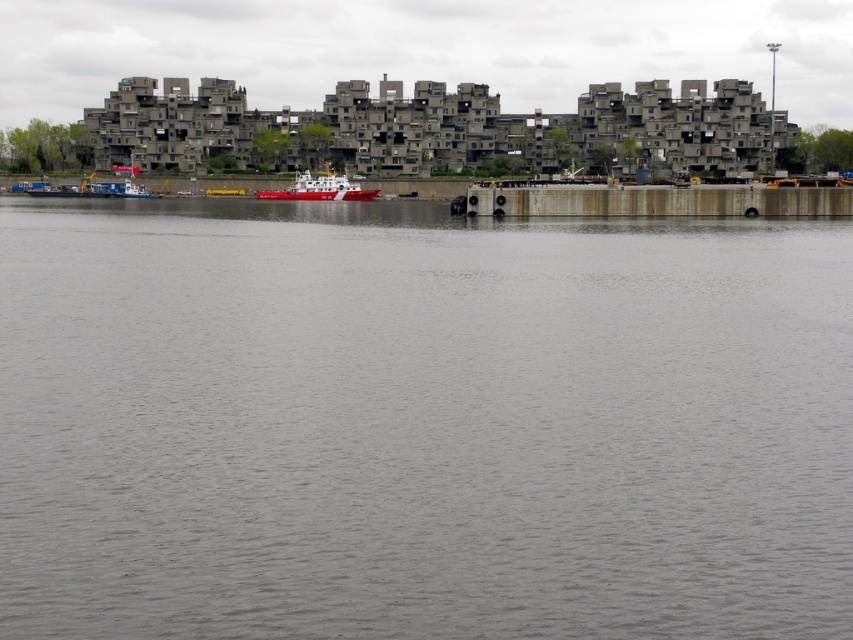
Question: Which of the following is the closest to the observer?

Choices:
 (A) red glossy boat at center
 (B) gray water at center

Answer: (B)

Question: Can you confirm if gray water at center is positioned to the left of red glossy boat at center?

Choices:
 (A) yes
 (B) no

Answer: (B)

Question: Which point is closer to the camera?

Choices:
 (A) red glossy boat at center
 (B) gray water at center

Answer: (B)

Question: Can you confirm if gray water at center is thinner than red glossy boat at center?

Choices:
 (A) no
 (B) yes

Answer: (A)

Question: Can you confirm if gray water at center is wider than red glossy boat at center?

Choices:
 (A) yes
 (B) no

Answer: (A)